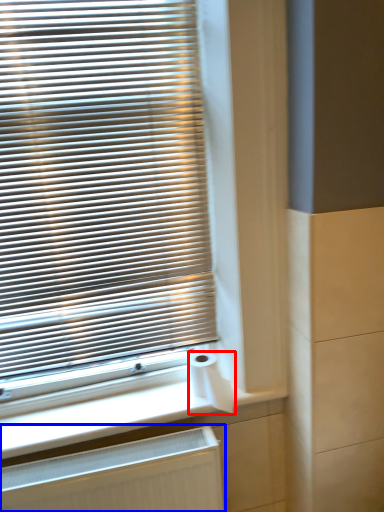
Question: Which point is closer to the camera, toilet paper (highlighted by a red box) or radiator (highlighted by a blue box)?

Choices:
 (A) toilet paper
 (B) radiator

Answer: (B)